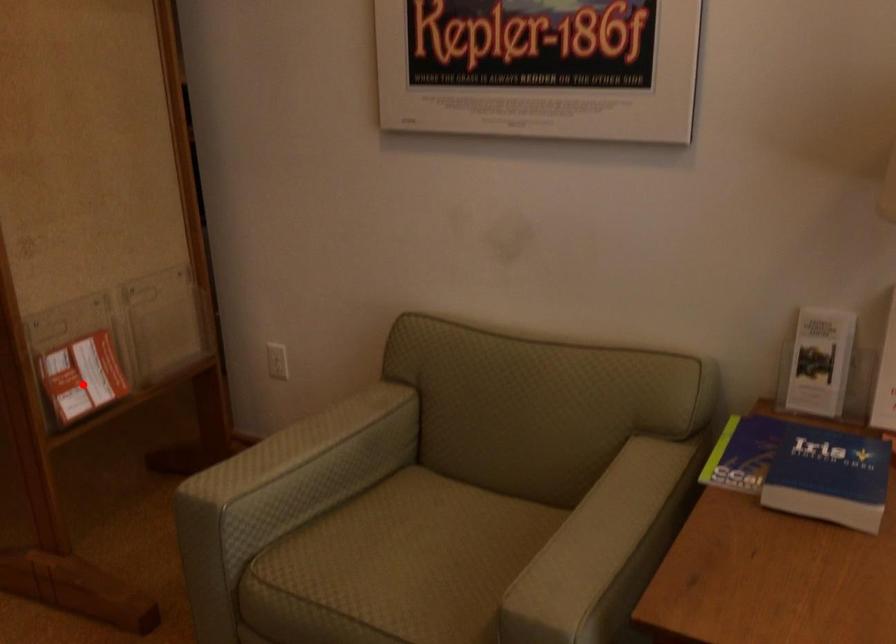
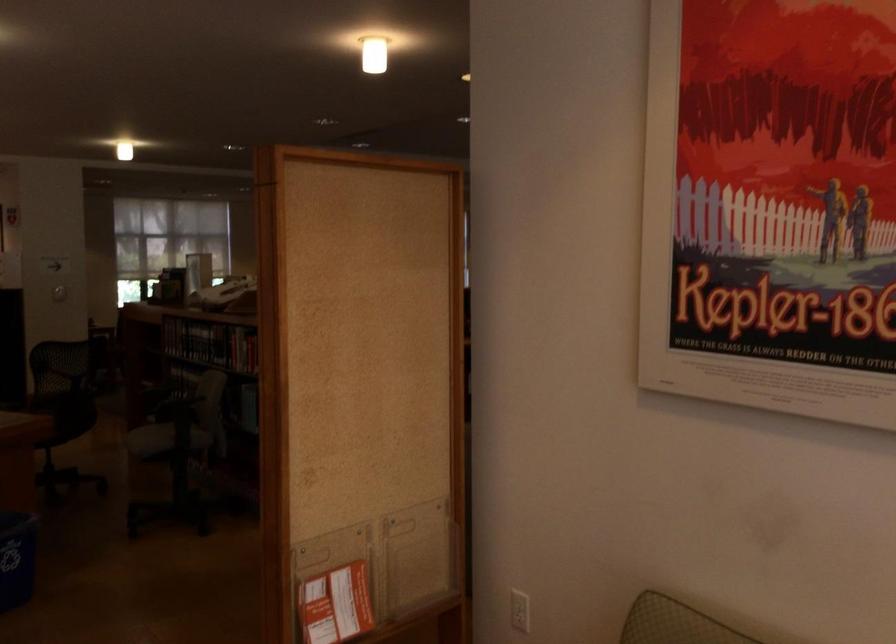
Locate, in the second image, the point that corresponds to the highlighted location in the first image.

(336, 605)